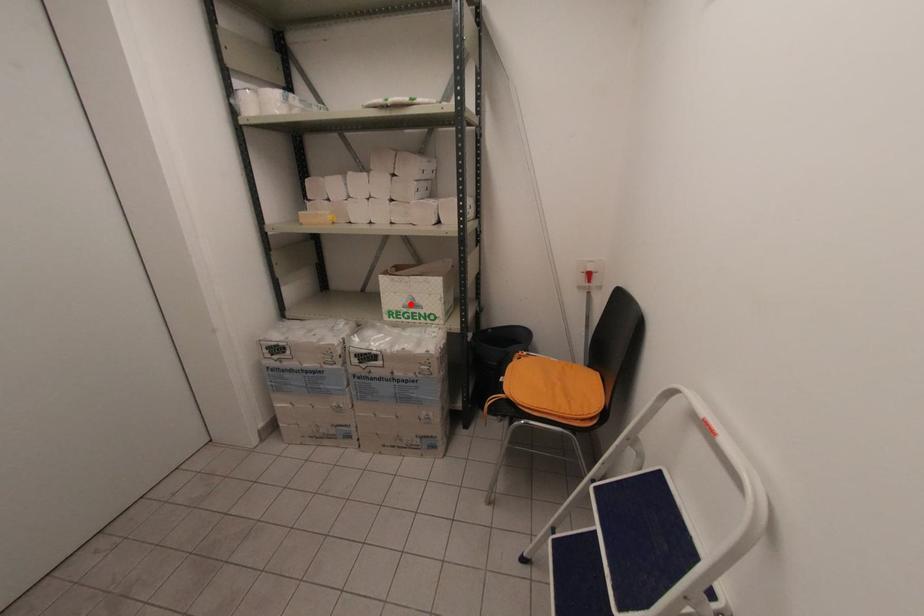
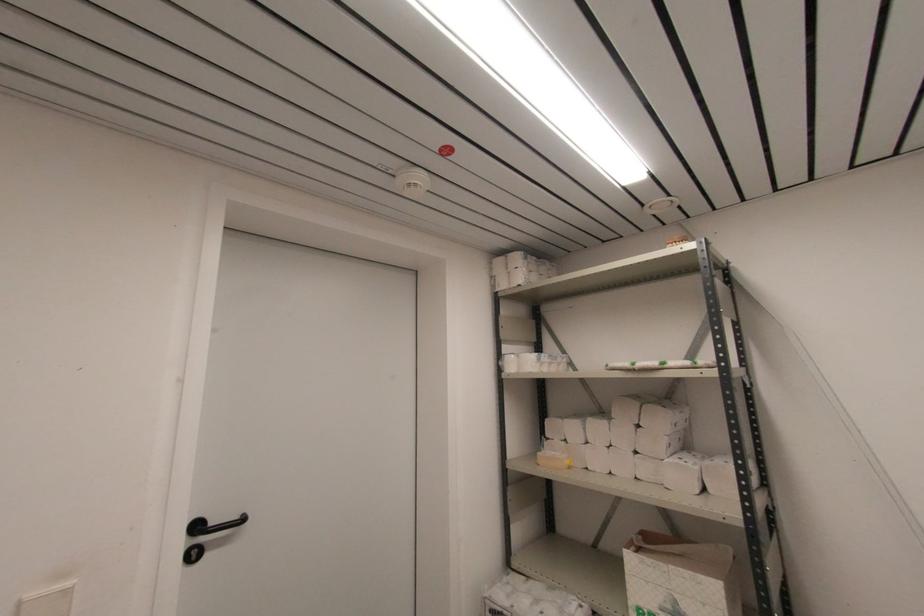
Find the pixel in the second image that matches the highlighted location in the first image.

(671, 609)